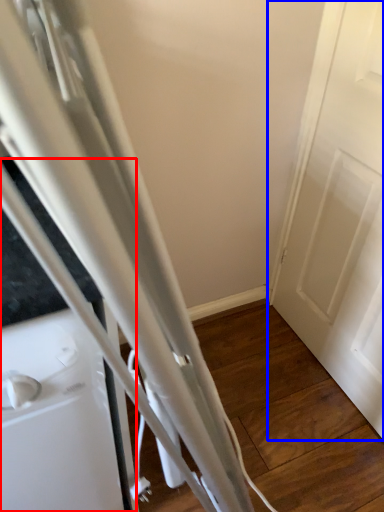
Question: Which point is further to the camera, appliance (highlighted by a red box) or door (highlighted by a blue box)?

Choices:
 (A) appliance
 (B) door

Answer: (B)